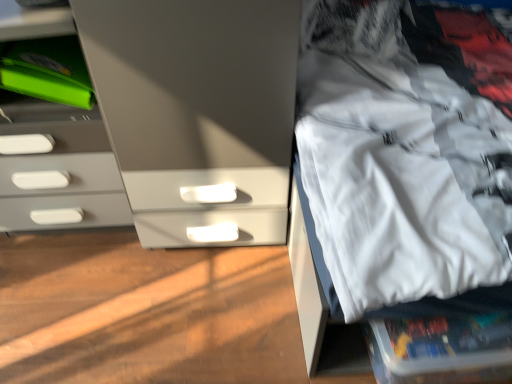
Question: From the image's perspective, is white fabric at right beneath matte gray chest of drawers at left?

Choices:
 (A) no
 (B) yes

Answer: (B)

Question: Can you confirm if white fabric at right is thinner than matte gray chest of drawers at left?

Choices:
 (A) no
 (B) yes

Answer: (A)

Question: Would you consider white fabric at right to be distant from matte gray chest of drawers at left?

Choices:
 (A) yes
 (B) no

Answer: (B)

Question: From the image's perspective, does white fabric at right appear higher than matte gray chest of drawers at left?

Choices:
 (A) no
 (B) yes

Answer: (A)

Question: Could you tell me if white fabric at right is turned towards matte gray chest of drawers at left?

Choices:
 (A) no
 (B) yes

Answer: (B)

Question: Considering the relative sizes of white fabric at right and matte gray chest of drawers at left in the image provided, is white fabric at right taller than matte gray chest of drawers at left?

Choices:
 (A) no
 (B) yes

Answer: (B)

Question: Is matte gray chest of drawers at left completely or partially outside of white fabric at right?

Choices:
 (A) no
 (B) yes

Answer: (B)

Question: Is white fabric at right completely or partially inside matte gray chest of drawers at left?

Choices:
 (A) yes
 (B) no

Answer: (B)

Question: Is matte gray chest of drawers at left smaller than white fabric at right?

Choices:
 (A) no
 (B) yes

Answer: (B)

Question: Can you confirm if matte gray chest of drawers at left is positioned to the left of white fabric at right?

Choices:
 (A) yes
 (B) no

Answer: (A)

Question: From the image's perspective, is matte gray chest of drawers at left located above white fabric at right?

Choices:
 (A) yes
 (B) no

Answer: (A)

Question: From a real-world perspective, is matte gray chest of drawers at left beneath white fabric at right?

Choices:
 (A) yes
 (B) no

Answer: (A)

Question: In terms of size, does matte gray chest of drawers at left appear bigger or smaller than white fabric at right?

Choices:
 (A) small
 (B) big

Answer: (A)